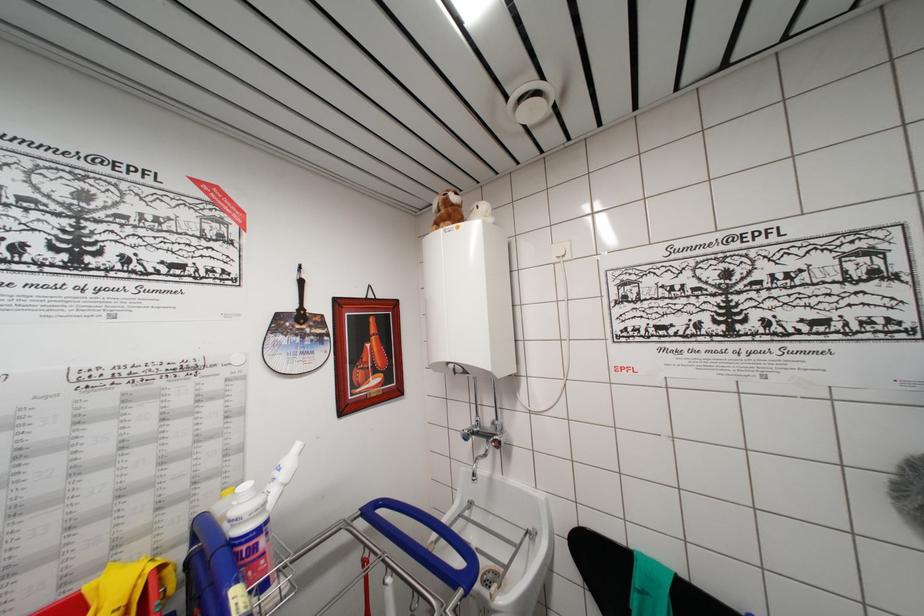
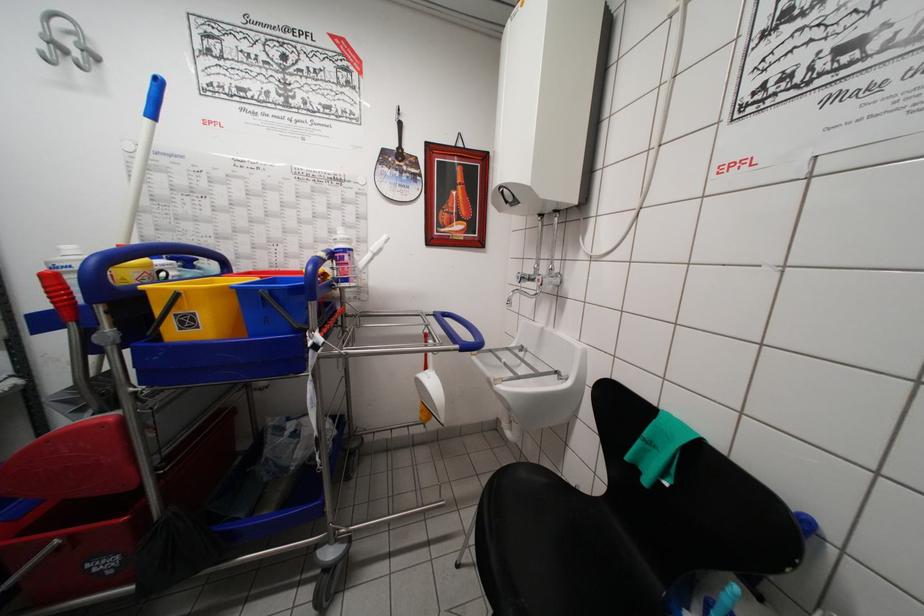
The point at (120,513) is marked in the first image. Where is the corresponding point in the second image?

(319, 252)